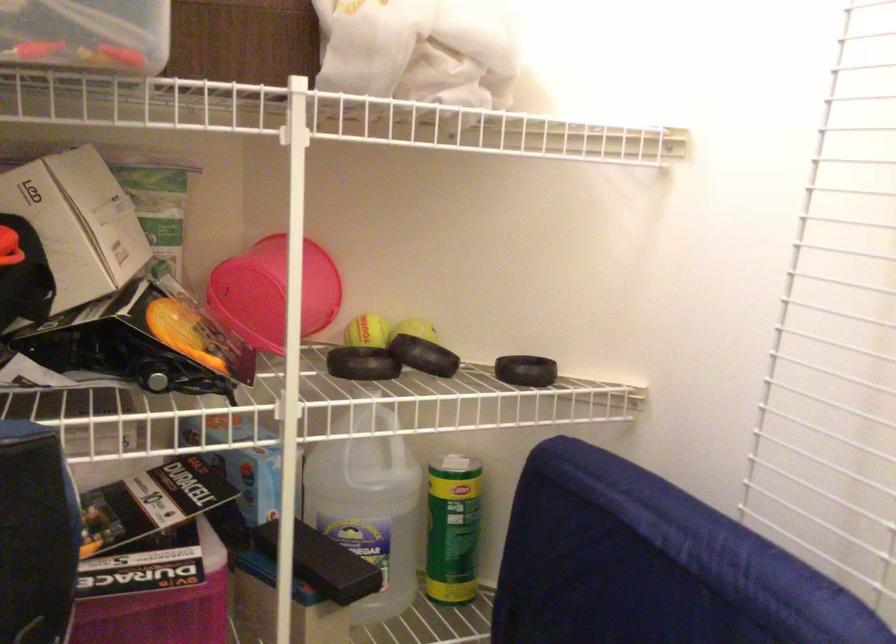
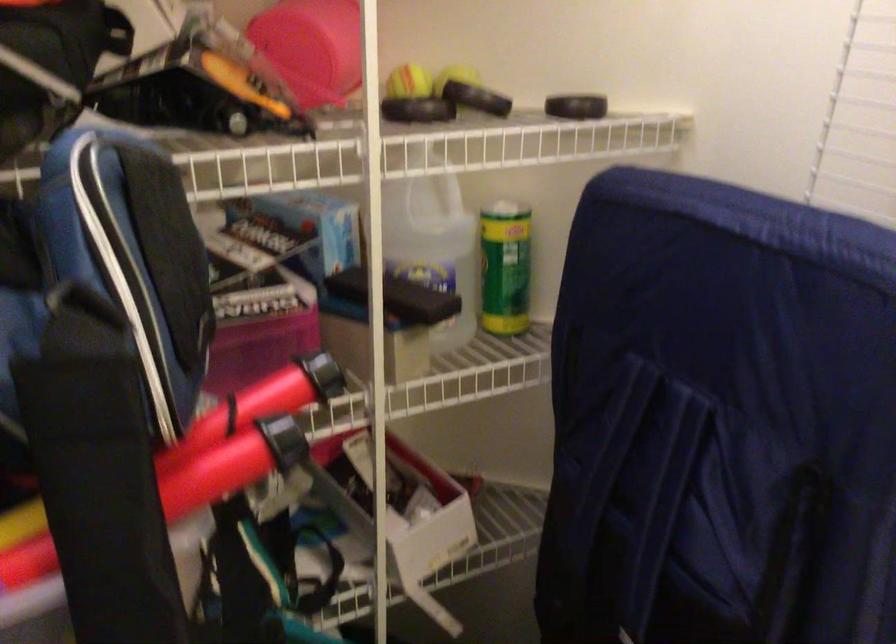
Locate, in the second image, the point that corresponds to (x=521, y=375) in the first image.

(576, 106)